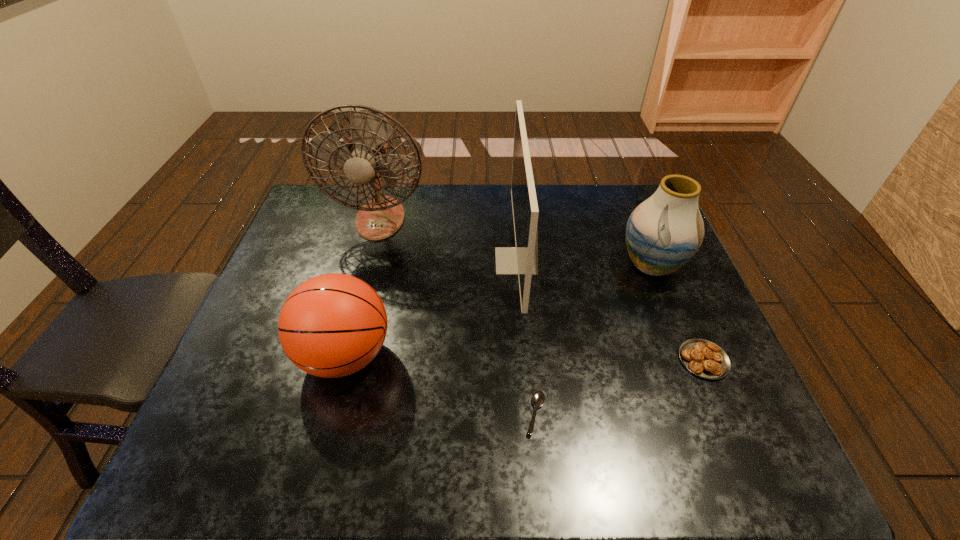
Locate an element on the screen. The image size is (960, 540). vacant area between the third shortest object and the fourth shortest object is located at coordinates (498, 310).

Find the location of `free space between the monitor and the fourth shortest object`. free space between the monitor and the fourth shortest object is located at coordinates (584, 263).

Identify the location of vacant space that's between the basketball and the monitor. (431, 308).

In order to click on empty location between the third shortest object and the monitor in this screenshot , I will do pos(431,308).

You are a GUI agent. You are given a task and a screenshot of the screen. Output one action in this format:
    pyautogui.click(x=<x>, y=<y>)
    Task: Click on the free space between the fifth tallest object and the vase
    
    Given the screenshot: What is the action you would take?
    (x=678, y=313)

Locate an element on the screen. free space between the fan and the monitor is located at coordinates click(x=448, y=240).

You are a GUI agent. You are given a task and a screenshot of the screen. Output one action in this format:
    pyautogui.click(x=<x>, y=<y>)
    Task: Click on the free space between the shortest object and the pastry
    This screenshot has width=960, height=540.
    Given the screenshot: What is the action you would take?
    pyautogui.click(x=620, y=387)

The image size is (960, 540). I want to click on blank region between the pastry and the third shortest object, so click(x=524, y=357).

Locate an element on the screen. object that is the second closest to the soupspoon is located at coordinates (332, 325).

Identify the location of the fifth closest object to the fan. Image resolution: width=960 pixels, height=540 pixels. click(705, 359).